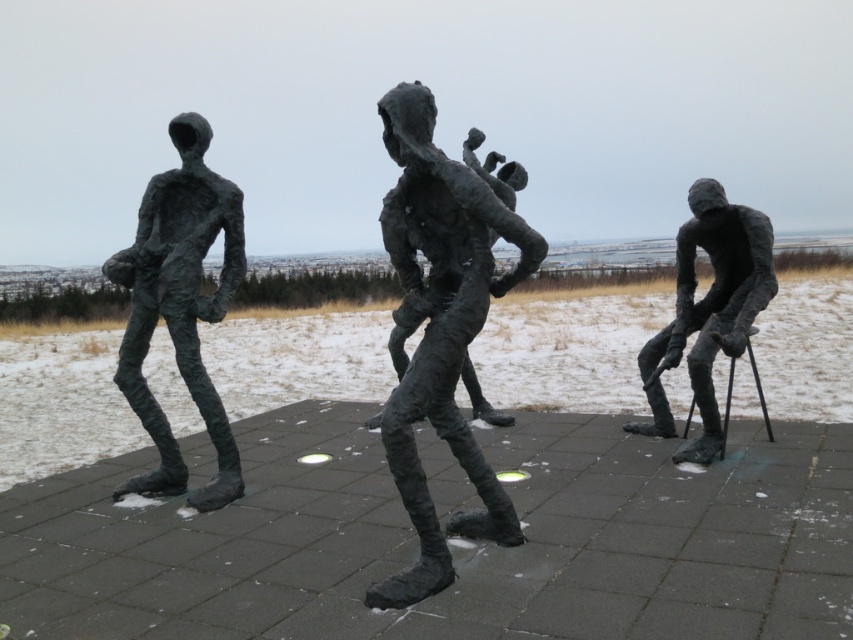
You are an art curator planning to install a new light fixture between the bronze sculpture at center and the bronze sculpture at right. Based on their positions, which sculpture should the light fixture be closer to in order to maintain symmetry between them?

The bronze sculpture at center is in front of the bronze sculpture at right, so to maintain symmetry, the light fixture should be placed closer to the bronze sculpture at right since it is farther back.

You are standing at the entrance of the sculpture installation and want to find the bronze sculpture at center. According to the coordinates provided, where should you look relative to your current position?

The bronze sculpture at center is located at point coordinates (442,323), which is directly ahead and slightly to the right of your current position at the entrance.